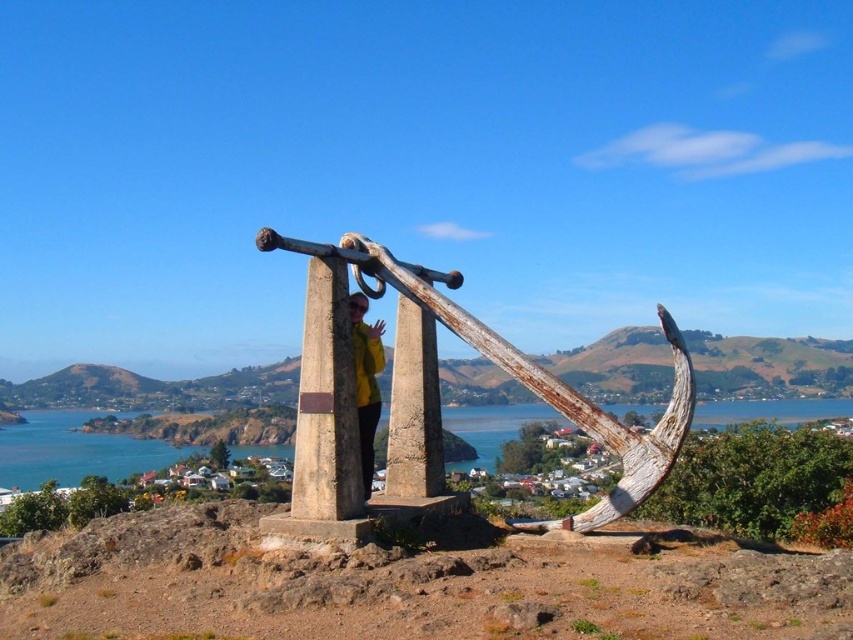
Question: Based on their relative distances, which object is nearer to the rusty metal anchor at center?

Choices:
 (A) blue water at center
 (B) yellow matte jacket at center

Answer: (B)

Question: Does rusty metal anchor at center come behind yellow matte jacket at center?

Choices:
 (A) no
 (B) yes

Answer: (A)

Question: Estimate the real-world distances between objects in this image. Which object is farther from the rusty metal anchor at center?

Choices:
 (A) blue water at center
 (B) yellow matte jacket at center

Answer: (A)

Question: Is rusty metal anchor at center smaller than yellow matte jacket at center?

Choices:
 (A) yes
 (B) no

Answer: (B)

Question: Can you confirm if rusty metal anchor at center is positioned to the right of blue water at center?

Choices:
 (A) yes
 (B) no

Answer: (A)

Question: Based on their relative distances, which object is nearer to the rusty metal anchor at center?

Choices:
 (A) blue water at center
 (B) yellow matte jacket at center

Answer: (B)